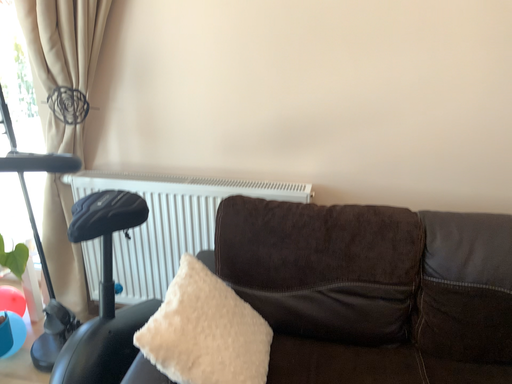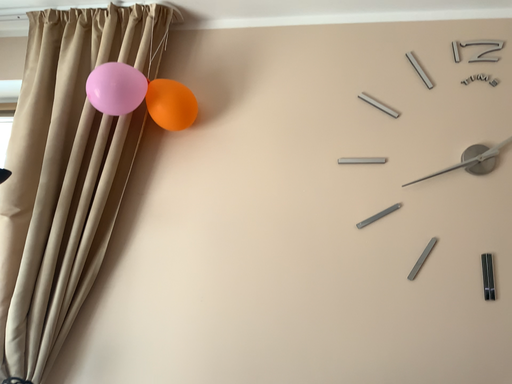
Question: Which way did the camera rotate in the video?

Choices:
 (A) rotated downward
 (B) rotated upward

Answer: (B)